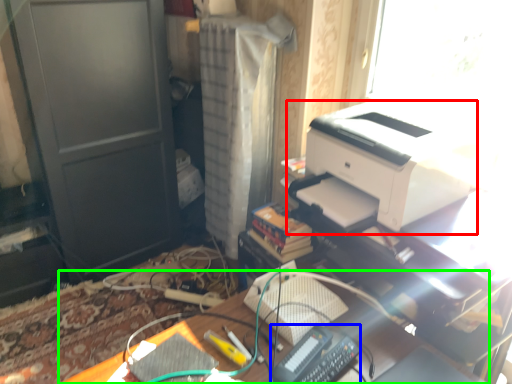
Question: Which object is positioned farthest from printer (highlighted by a red box)? Select from equipment (highlighted by a blue box) and desk (highlighted by a green box).

Choices:
 (A) equipment
 (B) desk

Answer: (A)